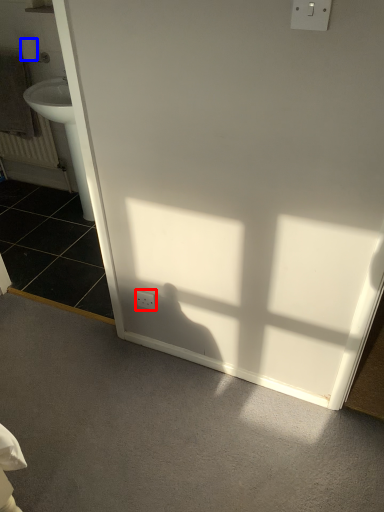
Question: Which of the following is the closest to the observer, electric outlet (highlighted by a red box) or toilet paper (highlighted by a blue box)?

Choices:
 (A) electric outlet
 (B) toilet paper

Answer: (A)